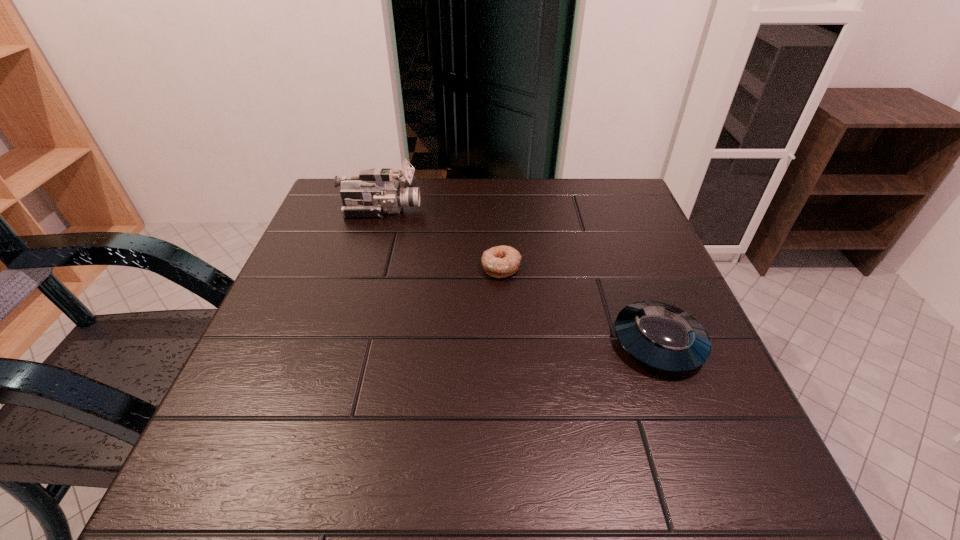
You are a GUI agent. You are given a task and a screenshot of the screen. Output one action in this format:
    pyautogui.click(x=<x>, y=<y>)
    Task: Click on the vacant space that satisfies the following two spatial constraints: 1. on the front-facing side of the saucer; 2. on the right side of the tallest object
    
    Given the screenshot: What is the action you would take?
    pyautogui.click(x=342, y=342)

This screenshot has height=540, width=960. I want to click on free space that satisfies the following two spatial constraints: 1. on the front-facing side of the leftmost object; 2. on the back side of the second object from left to right, so click(364, 267).